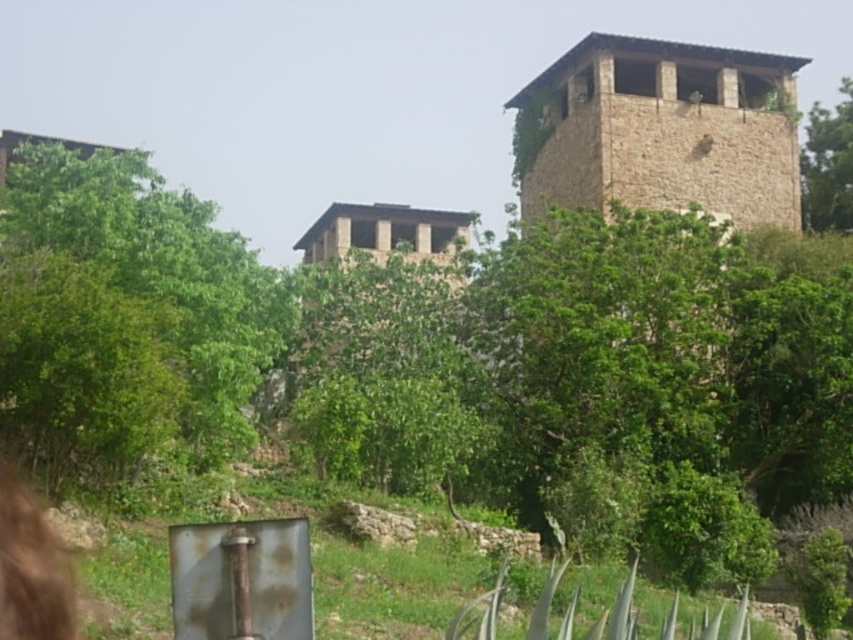
You are an architect designing a new garden layout. You need to place a statue exactly between the brown stone tower at upper right and the green leafy tree at upper right. Which side of the statue will be closer to the narrower structure?

The brown stone tower at upper right is narrower than the green leafy tree at upper right. Therefore, the side of the statue facing the brown stone tower at upper right will be closer to the narrower structure.

You are standing in front of the two stone towers surrounded by greenery. You notice a green leafy tree at left. Based on its position, can you determine if the tree is closer to you or farther away compared to the towers?

The green leafy tree at left is located at point (x=128, y=316), which places it in the foreground relative to the towers, indicating it is closer to you than the towers.